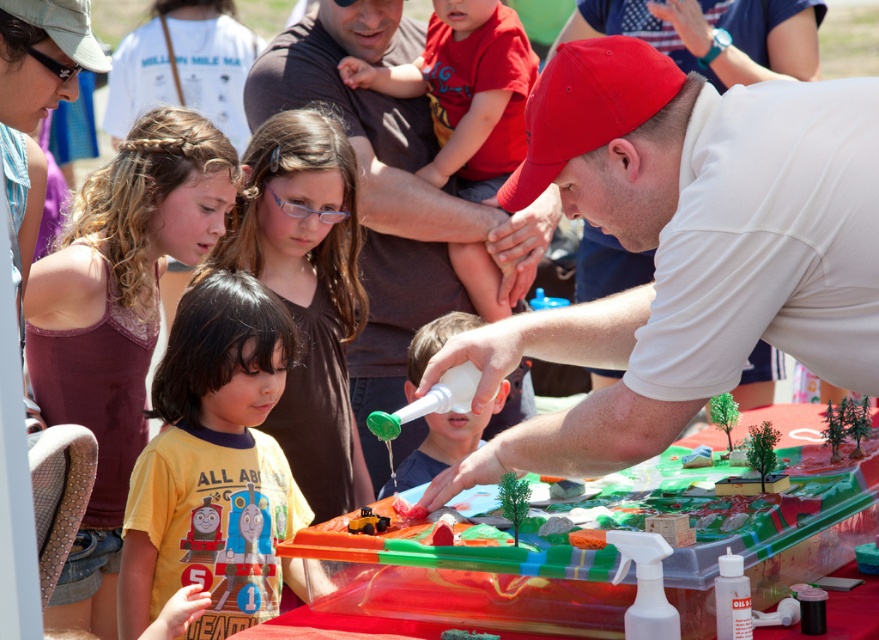
You are a photographer standing behind the group of people. You want to take a picture of the white matte shirt at center and the white matte bottle at center so that both are fully visible. Which object should you ensure is not blocking the other?

The white matte shirt at center is shorter than the white matte bottle at center. Therefore, you should ensure that the white matte bottle at center is not blocking the white matte shirt at center.

You are organizing a photo shoot and need to ensure that all participants are visible in the frame. You notice two children wearing yellow shirts in the scene. The first child is wearing a matte yellow shirt at center, and the second is wearing a yellow matte shirt at lower left. Which child is wearing a wider shirt?

The matte yellow shirt at center is wider than the yellow matte shirt at lower left.

You are a photographer at the science demonstration. You need to capture a clear photo of both the matte yellow shirt at center and the yellow matte shirt at lower left. Which one should you focus on first to ensure both are in frame?

You should focus on the matte yellow shirt at center first because it is larger in size than the yellow matte shirt at lower left, ensuring it fits within the frame while also capturing the smaller one.